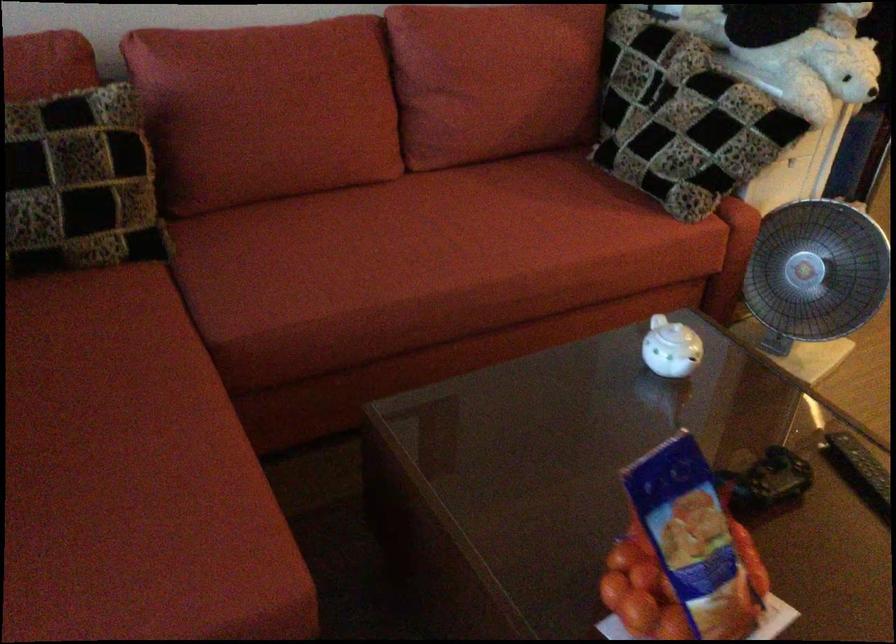
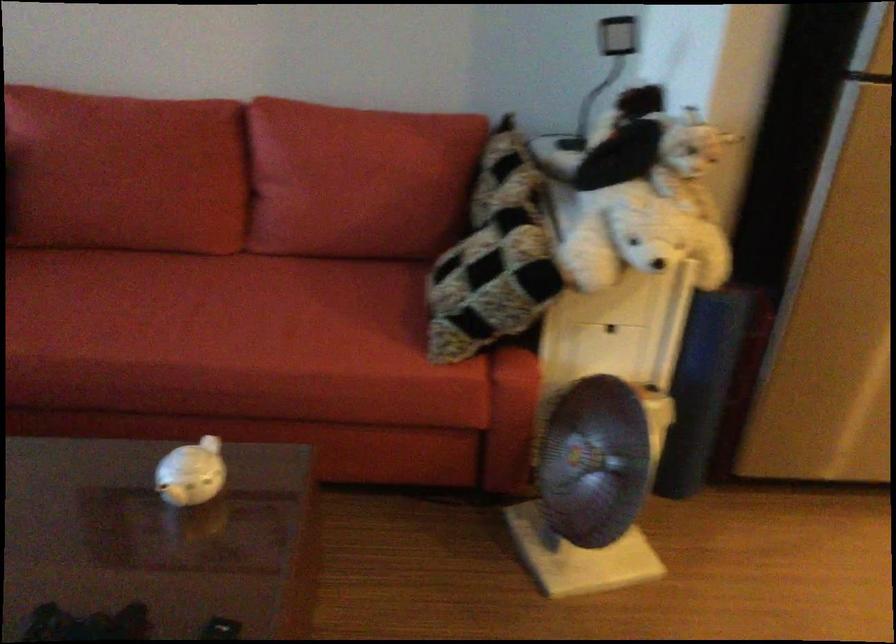
Question: What movement of the cameraman would produce the second image?

Choices:
 (A) Left
 (B) Right
 (C) Forward
 (D) Backward

Answer: (B)